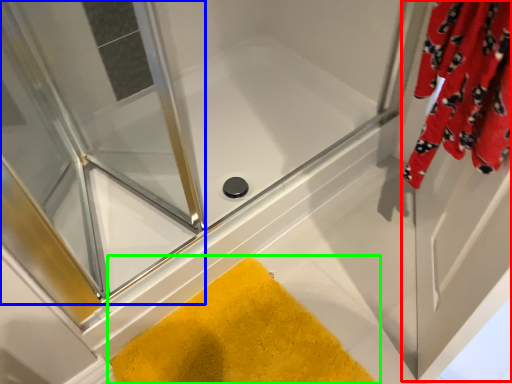
Question: Considering the real-world distances, which object is farthest from screen door (highlighted by a red box)? screen door (highlighted by a blue box) or bath mat (highlighted by a green box)?

Choices:
 (A) screen door
 (B) bath mat

Answer: (A)